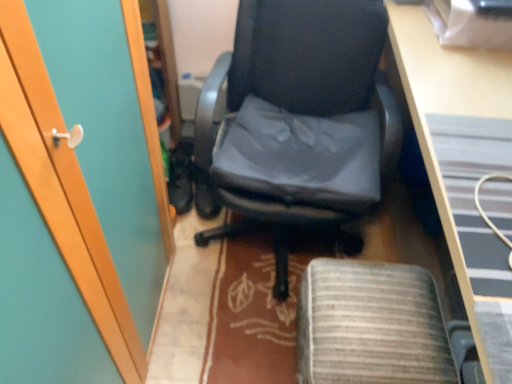
The height and width of the screenshot is (384, 512). In order to click on free space above black leather shoes at lower left (from a real-world perspective) in this screenshot , I will do `click(175, 145)`.